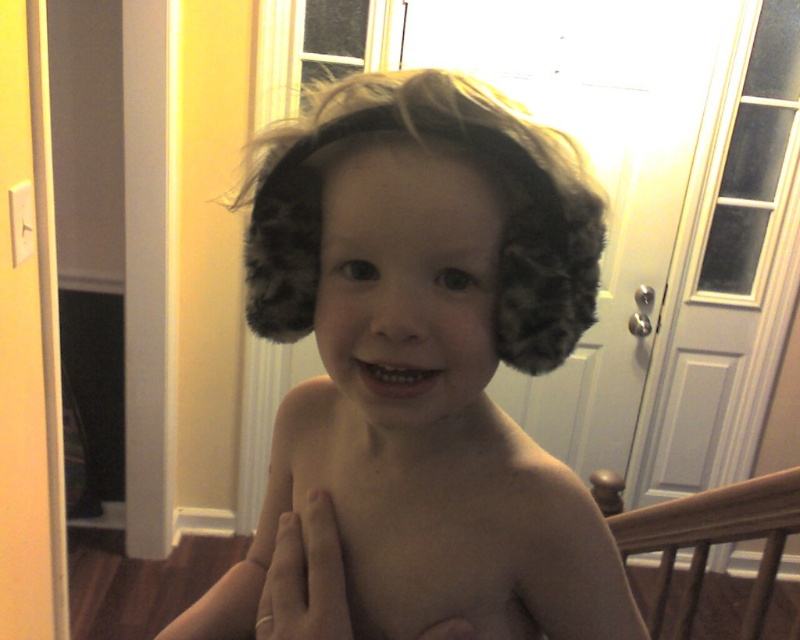
Does point (498, 115) come in front of point (748, 492)?

Yes.

Does fuzzy brown hair at center have a smaller size compared to brown wooden balustrade at lower right?

Indeed, fuzzy brown hair at center has a smaller size compared to brown wooden balustrade at lower right.

Is point (558, 355) positioned in front of point (688, 612)?

Yes.

Where is `fuzzy brown hair at center`? The image size is (800, 640). fuzzy brown hair at center is located at coordinates (456, 157).

Who is lower down, brown wooden balustrade at lower right or gold ring at chest?

brown wooden balustrade at lower right

Who is more forward, (758, 496) or (322, 524)?

Point (322, 524)

Where is `brown wooden balustrade at lower right`? brown wooden balustrade at lower right is located at coordinates (x=705, y=538).

Between fuzzy brown earmuffs at center and smooth skin at center, which one is positioned higher?

fuzzy brown earmuffs at center

Does point (358, 442) come in front of point (494, 621)?

That is False.

Which is in front, point (268, 499) or point (324, 413)?

Point (324, 413) is more forward.

This screenshot has width=800, height=640. What are the coordinates of `fuzzy brown earmuffs at center` in the screenshot? It's located at (418, 376).